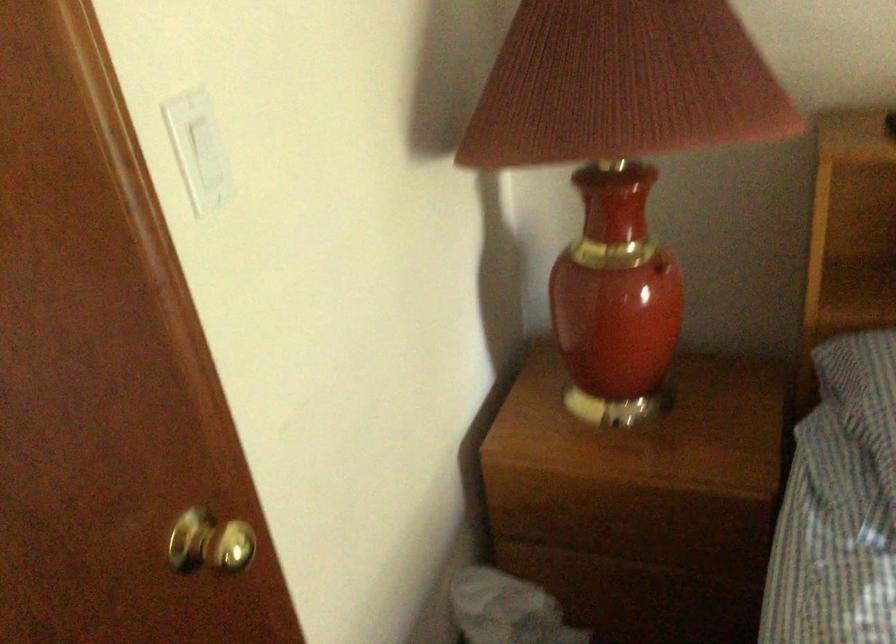
The image size is (896, 644). What do you see at coordinates (209, 542) in the screenshot?
I see `a gold door knob` at bounding box center [209, 542].